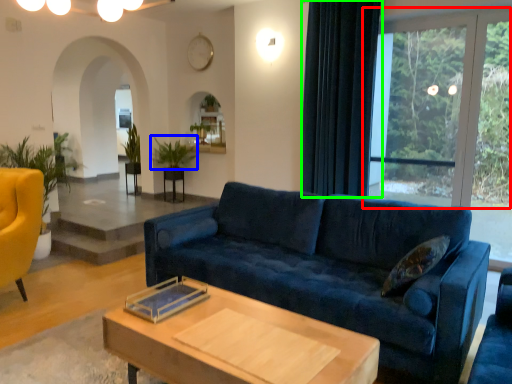
Question: Considering the real-world distances, which object is farthest from window (highlighted by a red box)? plant (highlighted by a blue box) or curtain (highlighted by a green box)?

Choices:
 (A) plant
 (B) curtain

Answer: (A)